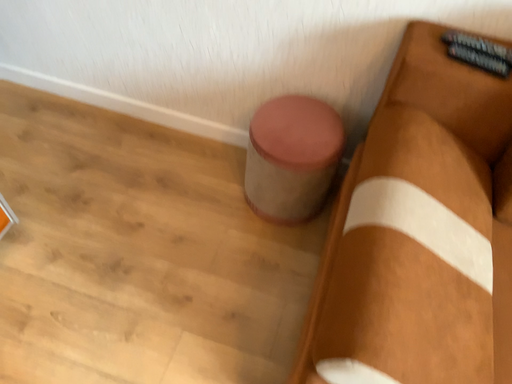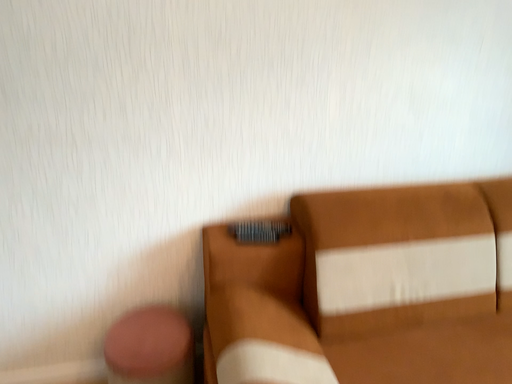
Question: Which way did the camera rotate in the video?

Choices:
 (A) rotated left
 (B) rotated right

Answer: (B)